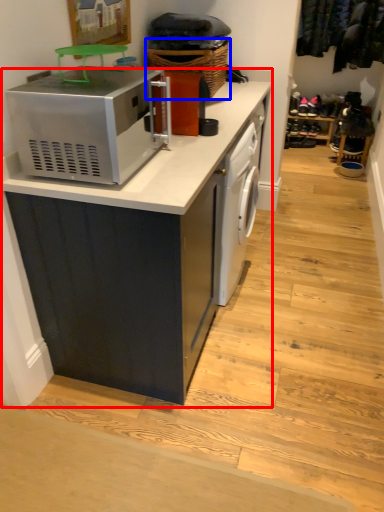
Question: Which object is closer to the camera taking this photo, cabinetry (highlighted by a red box) or basket (highlighted by a blue box)?

Choices:
 (A) cabinetry
 (B) basket

Answer: (A)